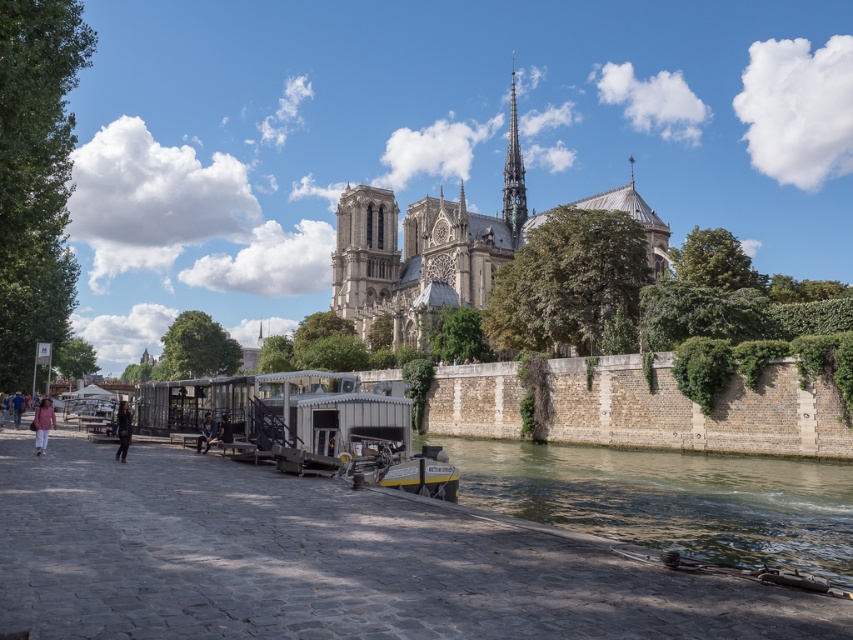
Question: Estimate the real-world distances between objects in this image. Which object is farther from the green glass spire at upper center?

Choices:
 (A) light brown wooden bench at center
 (B) stone gothic cathedral at center
 (C) pink fabric jacket at lower left

Answer: (C)

Question: Does greenish concrete river at lower right appear under light brown wooden bench at center?

Choices:
 (A) yes
 (B) no

Answer: (A)

Question: Can you confirm if greenish concrete river at lower right is positioned above pink fabric person at lower left?

Choices:
 (A) no
 (B) yes

Answer: (A)

Question: Which object is positioned closest to the light brown wooden bench at center?

Choices:
 (A) stone gothic cathedral at center
 (B) blue denim jeans at center
 (C) dark gray fabric jacket at lower left

Answer: (B)

Question: Can you confirm if greenish concrete river at lower right is positioned to the left of blue denim jeans at center?

Choices:
 (A) no
 (B) yes

Answer: (A)

Question: Which object appears closest to the camera in this image?

Choices:
 (A) stone gothic cathedral at center
 (B) greenish concrete river at lower right

Answer: (B)